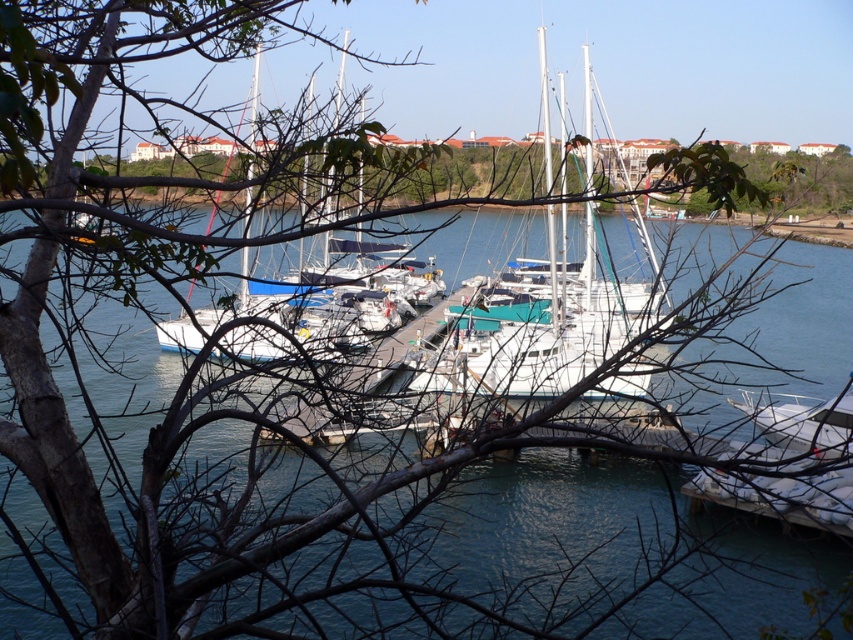
You are a photographer planning to capture the white glossy sailboat at center and the white glossy boat at lower right in a single frame. Given their sizes, which boat will appear bigger in your photo?

The white glossy sailboat at center will appear bigger in the photo because it is larger in size than the white glossy boat at lower right.

You are standing at the center of the wooden pier and want to locate the white glossy sailboat at center. According to the coordinates given, in which direction should you look to find it?

The white glossy sailboat at center is located at coordinates point (560,320), so you should look straight ahead since the x coordinate 0.500 indicates the center position horizontally, and the y coordinate 0.657 places it slightly below the center vertically.